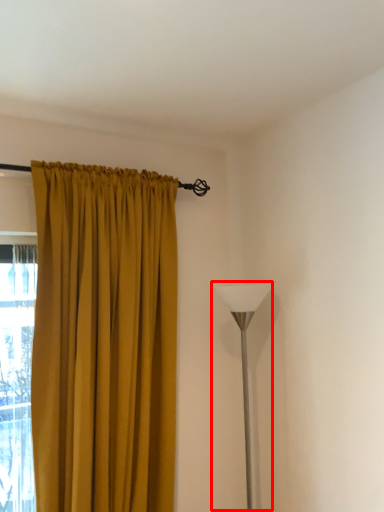
Question: Observing the image, what is the correct spatial positioning of table lamp (annotated by the red box) in reference to curtain?

Choices:
 (A) right
 (B) left

Answer: (A)